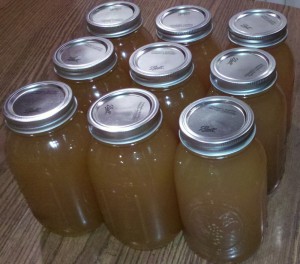
Image resolution: width=300 pixels, height=264 pixels. In order to click on leftmost jar in this screenshot , I will do `click(44, 168)`.